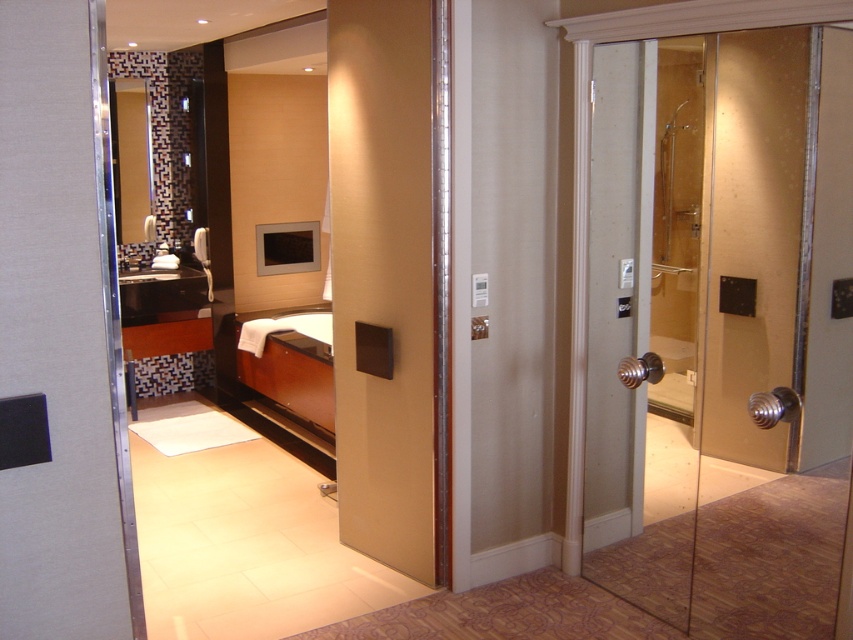
You are a guest in this bathroom and want to take a shower. The transparent glass shower at right is where you need to go. Which direction should you move from the matte black panel at center to reach it?

You should move to the right from the matte black panel at center to reach the transparent glass shower at right because the transparent glass shower at right is located to the right of the matte black panel at center.

You are designing a bathroom layout and want to ensure that the transparent glass shower at right and the matte black panel at center are positioned correctly. Based on their heights, which one should be placed lower to maintain visual balance?

The transparent glass shower at right is shorter than the matte black panel at center, so to maintain visual balance, the transparent glass shower at right should be placed lower than the matte black panel at center.